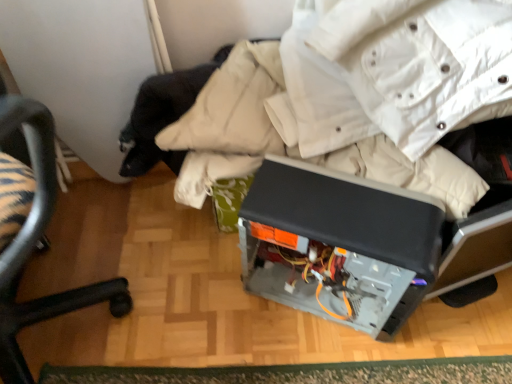
Locate an element on the screen. This screenshot has height=384, width=512. vacant space underneath black plastic chair at lower left (from a real-world perspective) is located at coordinates (78, 316).